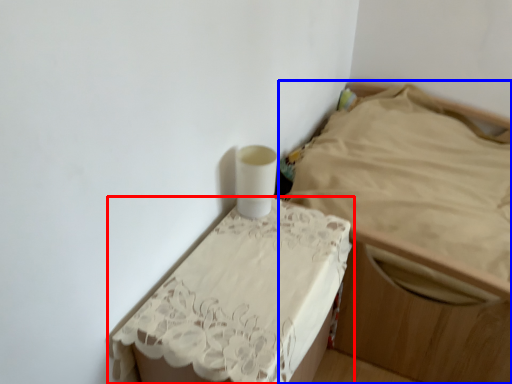
Question: Which of the following is the farthest to the observer, furniture (highlighted by a red box) or furniture (highlighted by a blue box)?

Choices:
 (A) furniture
 (B) furniture

Answer: (B)